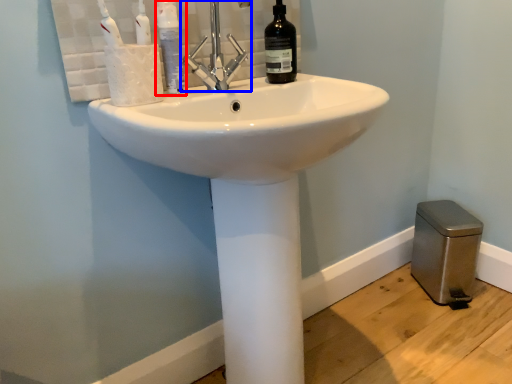
Question: Which object appears farthest to the camera in this image, mouthwash (highlighted by a red box) or tap (highlighted by a blue box)?

Choices:
 (A) mouthwash
 (B) tap

Answer: (A)